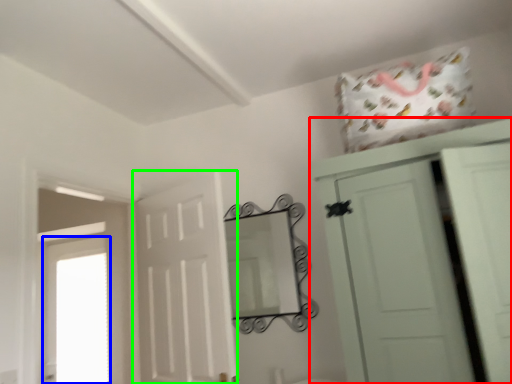
Question: Estimate the real-world distances between objects in this image. Which object is farther from cupboard (highlighted by a red box), window (highlighted by a blue box) or door (highlighted by a green box)?

Choices:
 (A) window
 (B) door

Answer: (A)